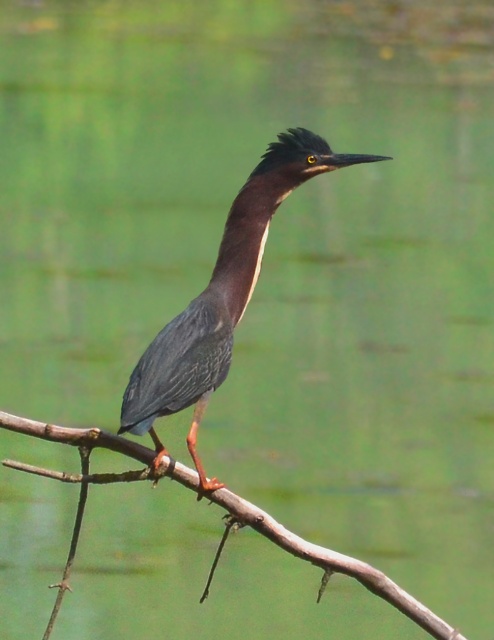
Question: Observing the image, what is the correct spatial positioning of green matte bird at center in reference to brown wood tree branch at center?

Choices:
 (A) above
 (B) below

Answer: (A)

Question: Does green matte bird at center appear on the right side of brown wood tree branch at center?

Choices:
 (A) yes
 (B) no

Answer: (A)

Question: Which point is closer to the camera taking this photo?

Choices:
 (A) (77, 515)
 (B) (225, 232)
 (C) (278, 154)

Answer: (A)

Question: Which point is farther from the camera taking this photo?

Choices:
 (A) (246, 291)
 (B) (231, 209)
 (C) (223, 500)

Answer: (B)

Question: Can you confirm if green matte bird at center is wider than brown wood tree branch at center?

Choices:
 (A) no
 (B) yes

Answer: (A)

Question: Which point is farther to the camera?

Choices:
 (A) green matte bird at center
 (B) brown wood tree branch at center
 (C) green glossy neck at center

Answer: (C)